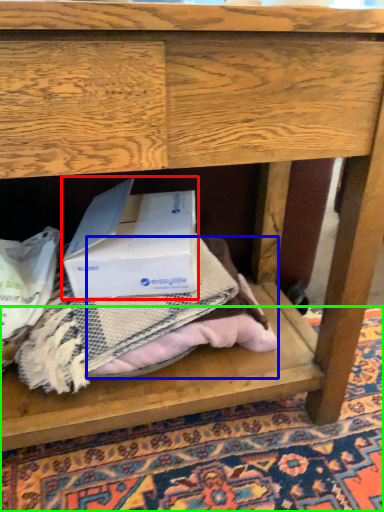
Question: Which object is the closest to the box (highlighted by a red box)? Choose among these: clothing (highlighted by a blue box) or mat (highlighted by a green box).

Choices:
 (A) clothing
 (B) mat

Answer: (A)